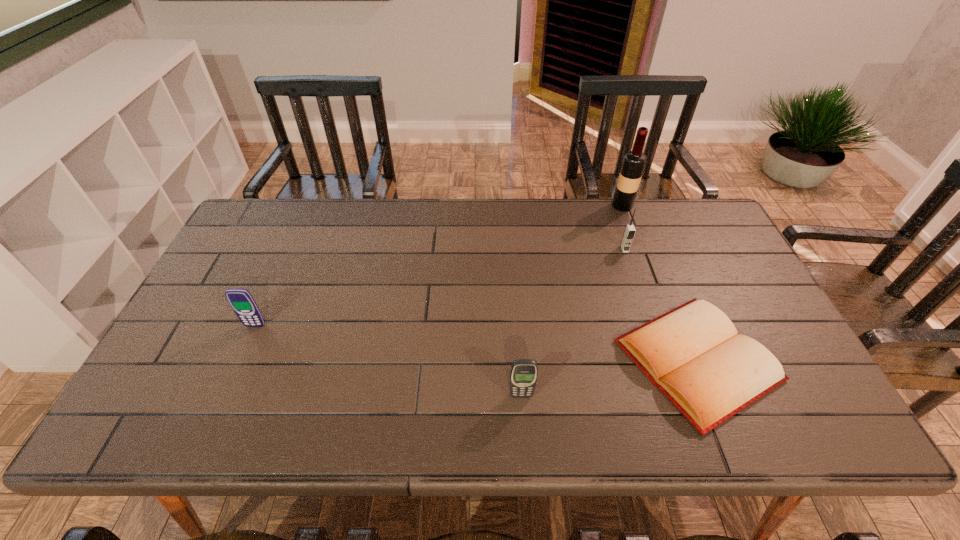
Identify the location of free location located 0.230m on the front-facing side of the second farthest object. (645, 311).

You are a GUI agent. You are given a task and a screenshot of the screen. Output one action in this format:
    pyautogui.click(x=<x>, y=<y>)
    Task: Click on the vacant position located 0.160m on the front-facing side of the leftmost object
    This screenshot has height=540, width=960.
    Given the screenshot: What is the action you would take?
    pyautogui.click(x=230, y=382)

This screenshot has width=960, height=540. Find the location of `free region located on the screen of the nearest cellular telephone`. free region located on the screen of the nearest cellular telephone is located at coordinates (523, 423).

Image resolution: width=960 pixels, height=540 pixels. Identify the location of blank area located 0.190m on the back of the shortest object. (655, 254).

In order to click on object that is positioned at the far edge in this screenshot , I will do `click(634, 161)`.

You are a GUI agent. You are given a task and a screenshot of the screen. Output one action in this format:
    pyautogui.click(x=<x>, y=<y>)
    Task: Click on the object that is at the near edge
    
    Given the screenshot: What is the action you would take?
    pyautogui.click(x=693, y=354)

Find the location of a particular element. object present at the left edge is located at coordinates (241, 301).

The image size is (960, 540). I want to click on object that is at the right edge, so click(693, 354).

I want to click on object at the near right corner, so click(693, 354).

Find the location of a particular element. The height and width of the screenshot is (540, 960). vacant region at the far edge is located at coordinates (324, 203).